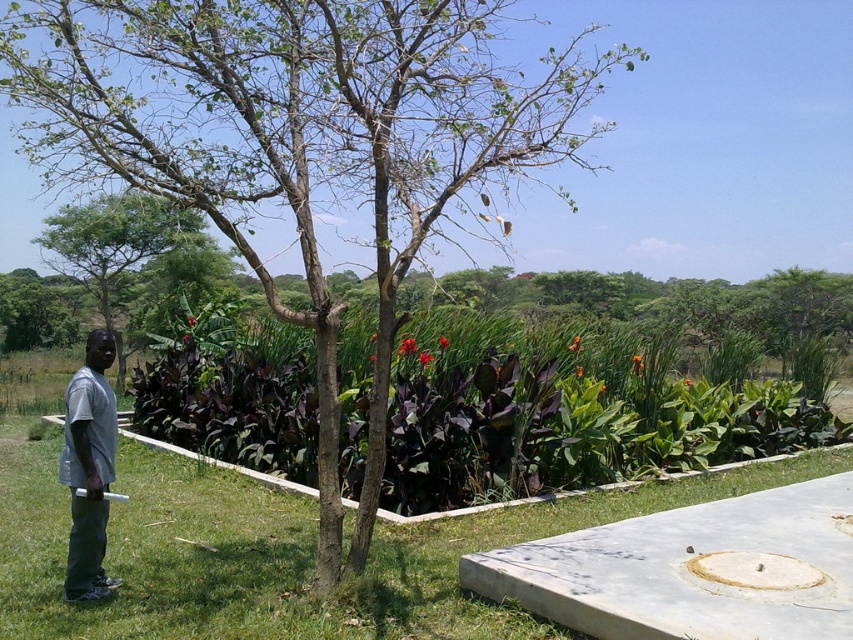
You are standing in the outdoor scene and want to move from the gray matte shirt at left to the green matte tree at left. Which direction should you move to get closer to the tree?

To get closer to the green matte tree at left, you should move to the left because the green matte tree at left is positioned on the left side of the gray matte shirt at left.

You are a photographer standing in the scene and want to take a photo of both the green matte tree at left and the gray matte shirt at left. Which object should you focus on first to ensure it appears sharp in the photo?

The green matte tree at left is further to the viewer than the gray matte shirt at left, so you should focus on the green matte tree at left first to ensure it appears sharp in the photo.